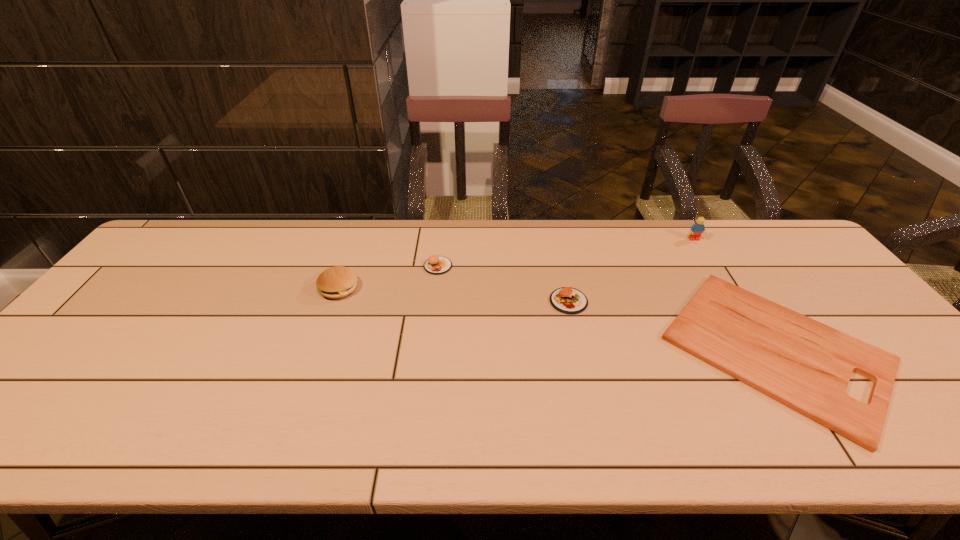
This screenshot has width=960, height=540. In order to click on vacant space located on the left of the fourth object from right to left in this screenshot , I will do `click(318, 266)`.

Find the location of a particular element. This screenshot has width=960, height=540. vacant space located 0.380m on the front of the fourth tallest object is located at coordinates (601, 449).

Locate an element on the screen. Lego present at the far edge is located at coordinates (697, 229).

You are a GUI agent. You are given a task and a screenshot of the screen. Output one action in this format:
    pyautogui.click(x=<x>, y=<y>)
    Task: Click on the patty that is positioned at the far edge
    
    Given the screenshot: What is the action you would take?
    pyautogui.click(x=436, y=265)

At what (x,y) coordinates should I click in order to perform the action: click on vacant space at the far edge of the desktop. Please return your answer as a coordinate pair (x, y). Image resolution: width=960 pixels, height=540 pixels. Looking at the image, I should click on (429, 238).

Identify the location of vacant region at the near edge of the desktop. (x=145, y=415).

At what (x,y) coordinates should I click in order to perform the action: click on vacant space at the left edge of the desktop. Please return your answer as a coordinate pair (x, y). Looking at the image, I should click on (177, 284).

Find the location of `blank space at the right edge`. blank space at the right edge is located at coordinates (870, 330).

This screenshot has width=960, height=540. I want to click on vacant space at the far left corner, so click(180, 231).

Where is `free space between the second object from left to right and the fourth tallest object`? free space between the second object from left to right and the fourth tallest object is located at coordinates (503, 284).